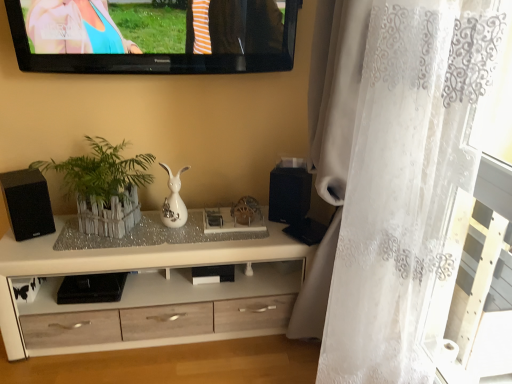
Find the location of `free location to the right of black matte speaker at left, arranged as the 2th speaker when viewed from the right`. free location to the right of black matte speaker at left, arranged as the 2th speaker when viewed from the right is located at coordinates (55, 234).